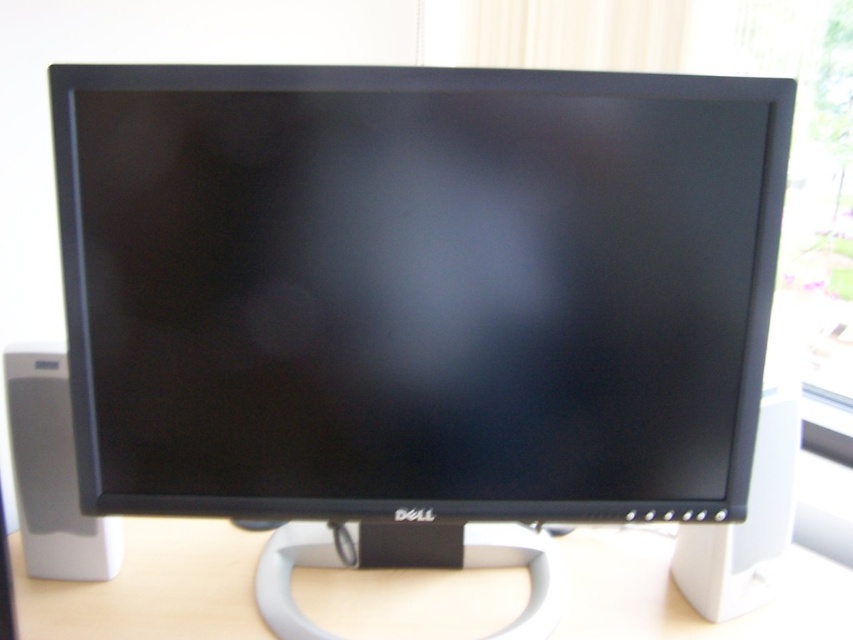
You are standing in front of a desk with a Dell computer monitor. You need to place a small sticker exactly at point (473,579) on the desk. If your hand can reach up to 95 centimeters, will you be able to reach that point?

The distance of point (473,579) from the camera is 96.24 centimeters, so the point is slightly out of reach since your hand can only extend up to 95 centimeters.

You are setting up a home office and want to place two white plastic speakers symmetrically on your desk. However, you notice that the white plastic speaker at left and the white plastic speaker at right are not aligned properly. Based on the image, which speaker is positioned higher on the desk?

The white plastic speaker at left is positioned higher than the white plastic speaker at right because it is located above it.

You are standing in the room and want to place a Dell computer monitor on the desk. Where exactly should you place it on the light wood computer desk at center?

The Dell computer monitor should be placed at point (152, 588) on the light wood computer desk at center as that is where the monitor is located.